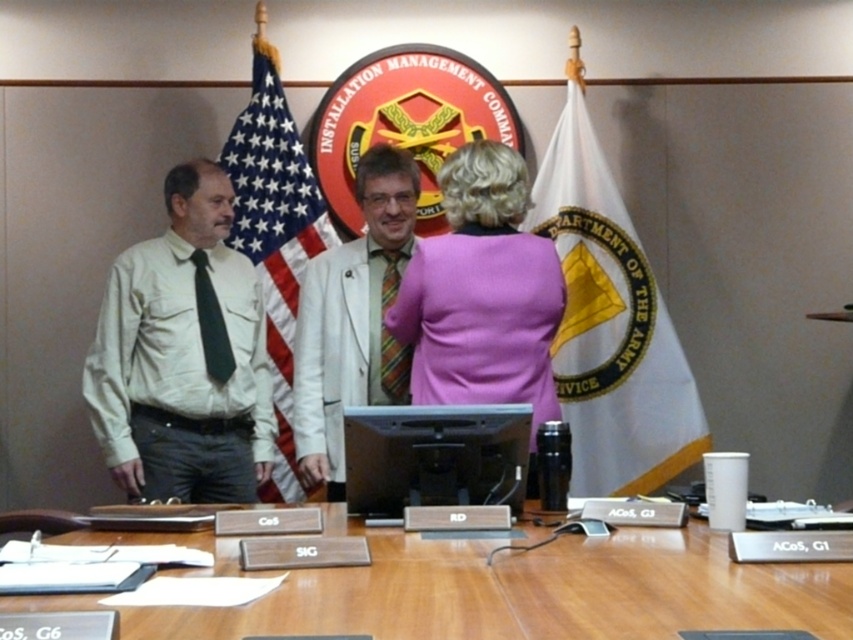
Is wooden table at center taller than purple fabric coat at center?

No, wooden table at center is not taller than purple fabric coat at center.

Is wooden table at center smaller than purple fabric coat at center?

Indeed, wooden table at center has a smaller size compared to purple fabric coat at center.

Who is more forward, (x=107, y=534) or (x=560, y=301)?

Point (x=107, y=534)

Find the location of a particular element. This screenshot has height=640, width=853. wooden table at center is located at coordinates (527, 592).

Measure the distance between wooden table at center and camera.

wooden table at center and camera are 1.02 meters apart from each other.

Between wooden table at center and american flag at center, which one has more height?

american flag at center is taller.

Is point (317, 624) behind point (235, 189)?

That is False.

Image resolution: width=853 pixels, height=640 pixels. I want to click on wooden table at center, so click(527, 592).

Is purple fabric coat at center wider than american flag at center?

Yes.

Who is more distant from viewer, [527,314] or [312,236]?

The point [312,236] is more distant.

The image size is (853, 640). In order to click on purple fabric coat at center in this screenshot , I will do `click(482, 292)`.